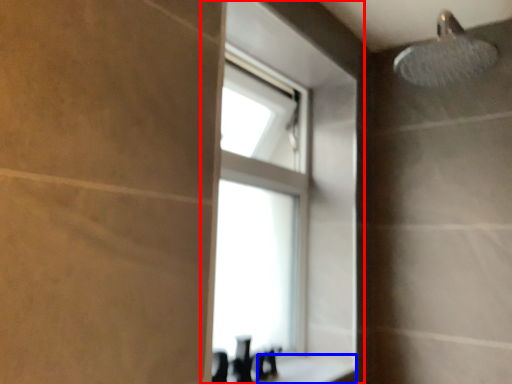
Question: Which point is further to the camera, window (highlighted by a red box) or counter top (highlighted by a blue box)?

Choices:
 (A) window
 (B) counter top

Answer: (A)